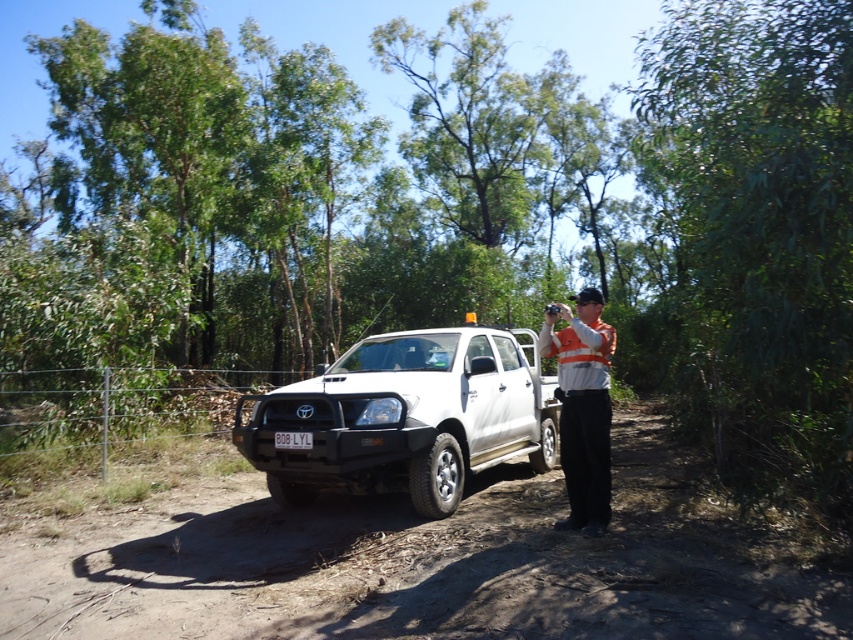
Between dirt field at center and orange reflective vest at center, which one is positioned lower?

dirt field at center

Who is shorter, dirt field at center or orange reflective vest at center?

dirt field at center

Which is in front, point (650, 419) or point (590, 333)?

Point (590, 333) is in front.

Image resolution: width=853 pixels, height=640 pixels. I want to click on dirt field at center, so click(424, 563).

Which of these two, dirt field at center or white matte truck at center, stands taller?

With more height is white matte truck at center.

Can you confirm if dirt field at center is shorter than white matte truck at center?

Yes.

Does point (703, 506) lie behind point (476, 444)?

No, (703, 506) is in front of (476, 444).

Find the location of a particular element. dirt field at center is located at coordinates (424, 563).

Does white matte truck at center have a greater height compared to white plastic license plate at center?

Yes, white matte truck at center is taller than white plastic license plate at center.

At what (x,y) coordinates should I click in order to perform the action: click on white matte truck at center. Please return your answer as a coordinate pair (x, y). The image size is (853, 640). Looking at the image, I should click on tap(407, 417).

This screenshot has width=853, height=640. I want to click on white matte truck at center, so click(407, 417).

Where is `white matte truck at center`? white matte truck at center is located at coordinates (407, 417).